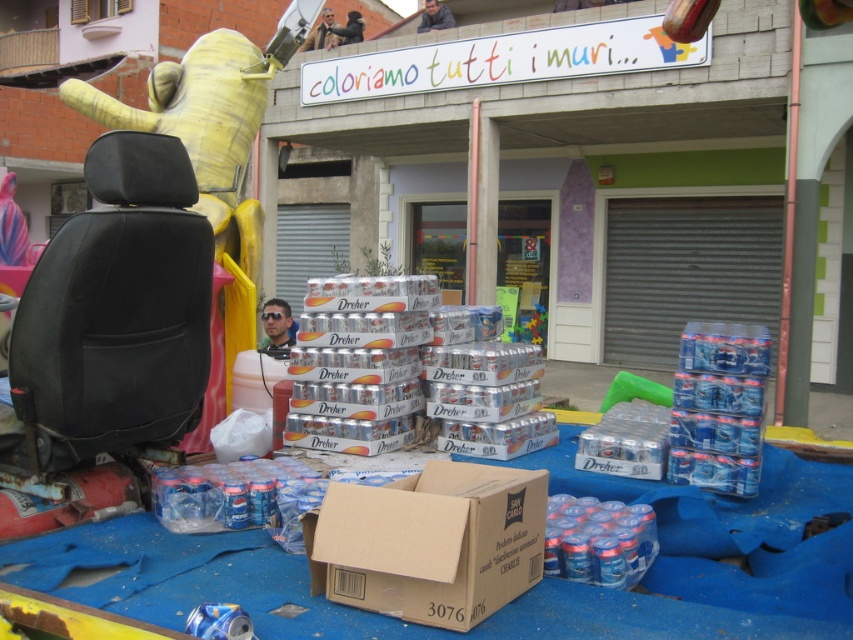
Question: Does black leather seat at left appear under brown cardboard box at center?

Choices:
 (A) no
 (B) yes

Answer: (A)

Question: Which object appears closest to the camera in this image?

Choices:
 (A) brown cardboard box at center
 (B) black leather seat at left

Answer: (A)

Question: Does black leather seat at left appear under brown cardboard box at center?

Choices:
 (A) yes
 (B) no

Answer: (B)

Question: Which point is closer to the camera?

Choices:
 (A) black leather seat at left
 (B) brown cardboard box at center

Answer: (B)

Question: Observing the image, what is the correct spatial positioning of black leather seat at left in reference to brown cardboard box at center?

Choices:
 (A) below
 (B) above

Answer: (B)